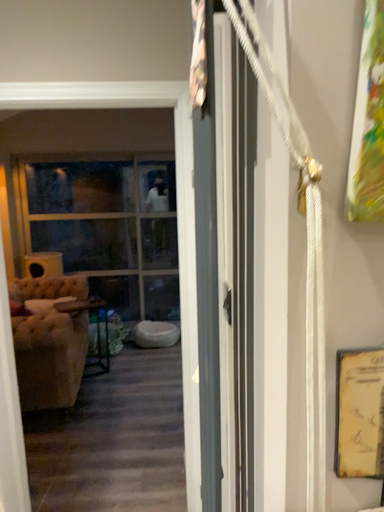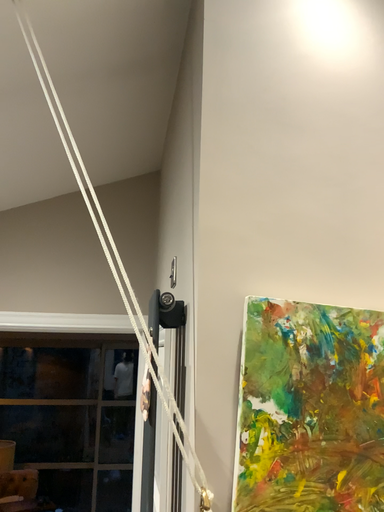
Question: Which way did the camera rotate in the video?

Choices:
 (A) rotated downward
 (B) rotated upward

Answer: (B)